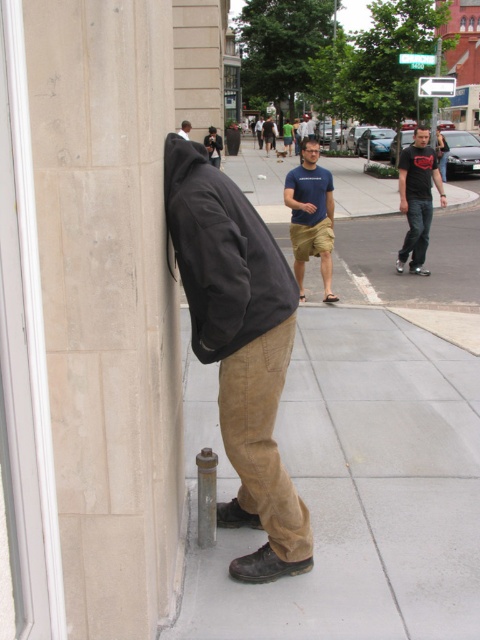
Is blue cotton t-shirt at center positioned at the back of black matte jacket at upper left?

No.

Is blue cotton t-shirt at center positioned before black matte jacket at upper left?

Yes.

Where is `blue cotton t-shirt at center`? This screenshot has width=480, height=640. blue cotton t-shirt at center is located at coordinates (311, 216).

Locate an element on the screen. This screenshot has height=640, width=480. blue cotton t-shirt at center is located at coordinates (311, 216).

In the scene shown: Does black matte jacket at left have a larger size compared to black matte jacket at upper left?

Actually, black matte jacket at left might be smaller than black matte jacket at upper left.

Is point (204, 243) farther from camera compared to point (187, 131)?

No, it is not.

Is point (253, 208) positioned before point (186, 138)?

Yes, point (253, 208) is closer to viewer.

Where is `black matte jacket at left`? This screenshot has width=480, height=640. black matte jacket at left is located at coordinates 222,253.

Who is higher up, dark gray hoodie at left or black cotton t-shirt at center-right?

black cotton t-shirt at center-right

Is point (298, 568) more distant than point (403, 156)?

That is False.

Identify the location of dark gray hoodie at left. The image size is (480, 640). (240, 348).